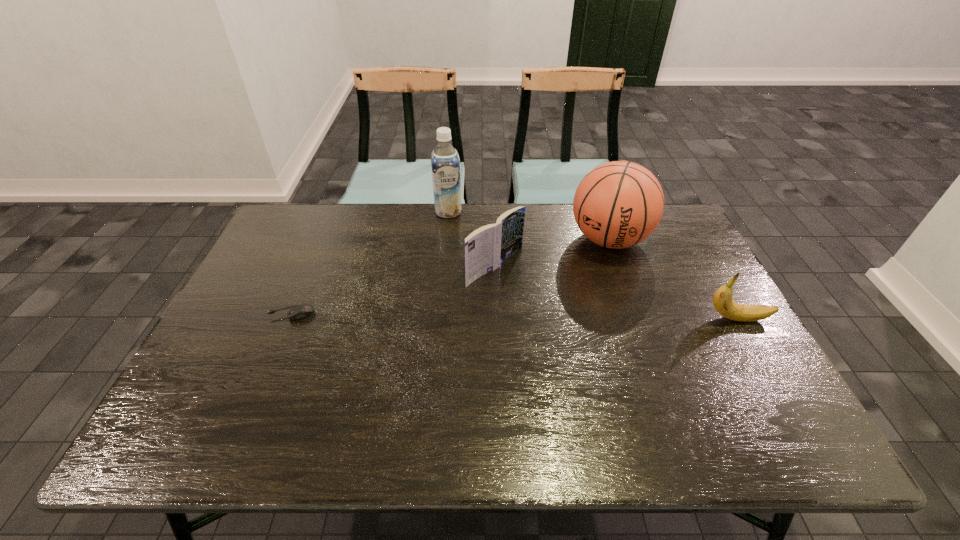
Identify the location of free space located 0.380m on the surface of the basketball near the brand logo. (563, 356).

The image size is (960, 540). In order to click on free space located 0.270m on the surface of the basketball near the brand logo in this screenshot , I will do `click(575, 326)`.

The height and width of the screenshot is (540, 960). Identify the location of free space located 0.060m on the surface of the basketball near the brand logo. (594, 276).

Identify the location of free space located on the label of the soya milk. The width and height of the screenshot is (960, 540). (452, 233).

The height and width of the screenshot is (540, 960). What are the coordinates of `free space located 0.380m on the label of the soya milk` in the screenshot? It's located at (464, 298).

Where is `vacant space located on the label of the soya milk`? The width and height of the screenshot is (960, 540). vacant space located on the label of the soya milk is located at coordinates (451, 228).

The width and height of the screenshot is (960, 540). I want to click on basketball that is at the far edge, so click(619, 204).

At what (x,y) coordinates should I click in order to perform the action: click on soya milk located in the far edge section of the desktop. Please return your answer as a coordinate pair (x, y). Looking at the image, I should click on (445, 163).

Where is `object present at the left edge`? The width and height of the screenshot is (960, 540). object present at the left edge is located at coordinates (299, 312).

Identify the location of banana at the right edge. (x=722, y=300).